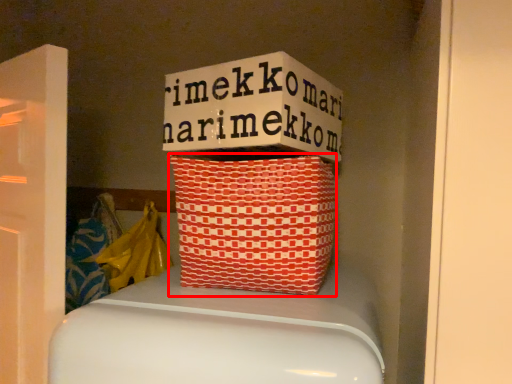
Question: Observing the image, what is the correct spatial positioning of basket (annotated by the red box) in reference to material?

Choices:
 (A) right
 (B) left

Answer: (A)